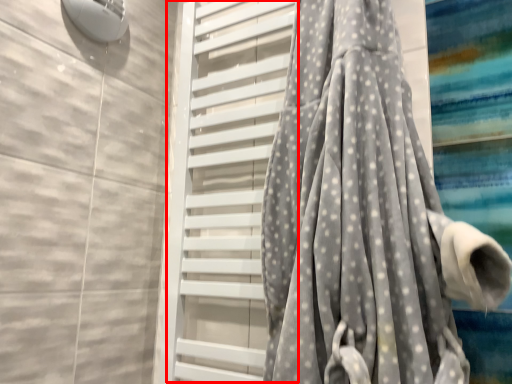
Question: From the image's perspective, where is screen door (annotated by the red box) located relative to curtain?

Choices:
 (A) above
 (B) below

Answer: (B)